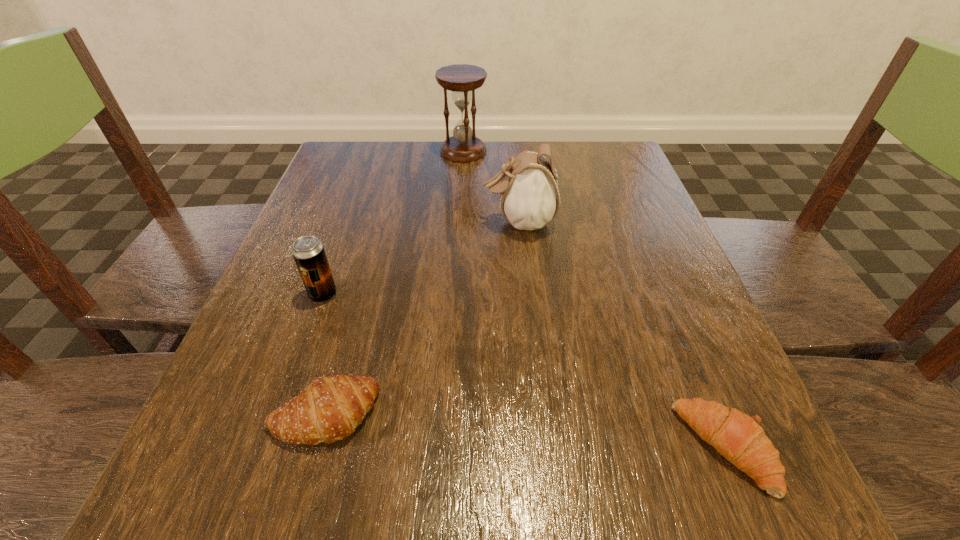
Image resolution: width=960 pixels, height=540 pixels. I want to click on the farthest object, so click(461, 79).

Where is `pouch`? pouch is located at coordinates (529, 194).

Find the location of a particular element. This screenshot has width=960, height=540. the fourth nearest object is located at coordinates (529, 194).

At what (x,y) coordinates should I click in order to perform the action: click on the third shortest object. Please return your answer as a coordinate pair (x, y). The image size is (960, 540). Looking at the image, I should click on (308, 252).

Identify the location of beer can. tap(308, 252).

In order to click on the left crescent roll in this screenshot , I will do `click(329, 409)`.

The width and height of the screenshot is (960, 540). In order to click on the taller crescent roll in this screenshot , I will do `click(329, 409)`.

Where is `the shortest object`? This screenshot has height=540, width=960. the shortest object is located at coordinates (739, 438).

In order to click on the shorter crescent roll in this screenshot , I will do `click(739, 438)`.

In order to click on free region located 0.120m on the right of the hourglass in this screenshot , I will do `click(534, 152)`.